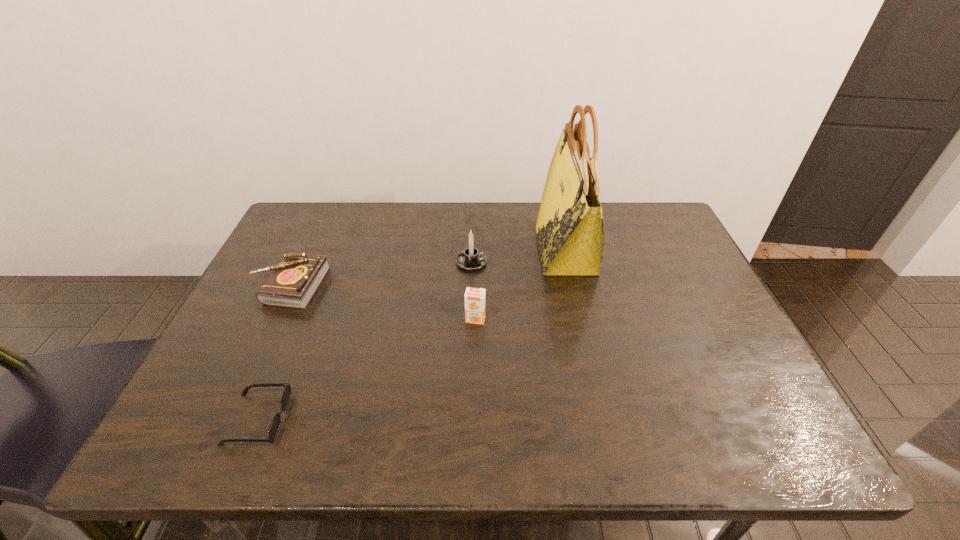
In the image, there is a desktop. Where is `vacant space at the far edge`? The height and width of the screenshot is (540, 960). vacant space at the far edge is located at coordinates (375, 207).

At what (x,y) coordinates should I click in order to perform the action: click on free space at the near edge. Please return your answer as a coordinate pair (x, y). This screenshot has height=540, width=960. Looking at the image, I should click on (353, 422).

The width and height of the screenshot is (960, 540). I want to click on blank area at the left edge, so click(x=222, y=397).

The image size is (960, 540). Identify the location of free space at the right edge. (745, 389).

Find the location of a particular element. This screenshot has height=540, width=960. blank space at the far left corner is located at coordinates (316, 207).

The image size is (960, 540). In order to click on free space at the near left corner in this screenshot , I will do `click(241, 422)`.

The height and width of the screenshot is (540, 960). I want to click on vacant area that lies between the tallest object and the fourth farthest object, so click(520, 285).

Where is `free space between the second shortest object and the rightmost object`? This screenshot has width=960, height=540. free space between the second shortest object and the rightmost object is located at coordinates (428, 268).

Where is `free space between the tallest object and the orange juice`? free space between the tallest object and the orange juice is located at coordinates (520, 285).

The image size is (960, 540). In order to click on vacant space that's between the second nearest object and the tote bag in this screenshot , I will do `click(520, 285)`.